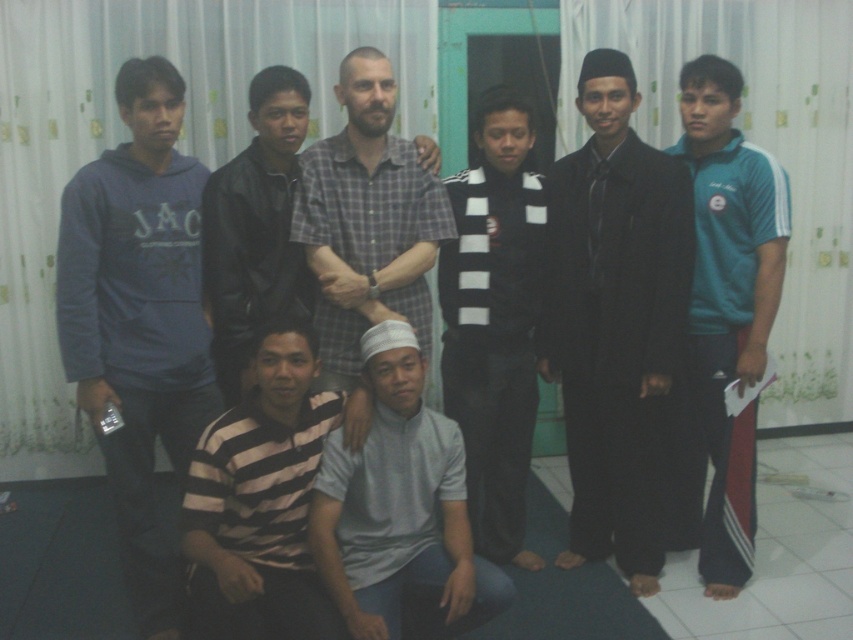
Question: Which object appears farthest from the camera in this image?

Choices:
 (A) black leather jacket at upper center
 (B) matte blue hoodie at left

Answer: (A)

Question: Which point is farther to the camera?

Choices:
 (A) matte blue hoodie at left
 (B) striped cotton shirt at lower center
 (C) black leather jacket at upper center
 (D) plaid cotton shirt at center

Answer: (C)

Question: Is matte blue hoodie at left bigger than black leather jacket at upper center?

Choices:
 (A) yes
 (B) no

Answer: (A)

Question: Can you confirm if matte blue hoodie at left is positioned above gray matte shirt at center?

Choices:
 (A) no
 (B) yes

Answer: (B)

Question: Considering the real-world distances, which object is closest to the black matte suit at center?

Choices:
 (A) black leather jacket at upper center
 (B) striped cotton shirt at lower center

Answer: (A)

Question: Does teal athletic wear at right appear on the left side of striped cotton shirt at lower center?

Choices:
 (A) no
 (B) yes

Answer: (A)